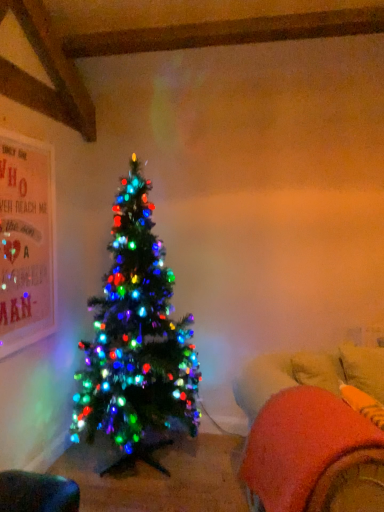
Question: Considering the relative positions of velvet orange bean bag chair at lower left, the second bean bag chair positioned from the right, and fluffy orange bean bag at lower right, acting as the second bean bag chair starting from the bottom, in the image provided, is velvet orange bean bag chair at lower left, the second bean bag chair positioned from the right, to the left of fluffy orange bean bag at lower right, acting as the second bean bag chair starting from the bottom, from the viewer's perspective?

Choices:
 (A) yes
 (B) no

Answer: (A)

Question: Is velvet orange bean bag chair at lower left, the 2th bean bag chair in the top-to-bottom sequence, oriented towards fluffy orange bean bag at lower right, placed as the 1th bean bag chair when sorted from right to left?

Choices:
 (A) yes
 (B) no

Answer: (A)

Question: Is velvet orange bean bag chair at lower left, the first bean bag chair positioned from the left, oriented away from fluffy orange bean bag at lower right, arranged as the 1th bean bag chair when viewed from the top?

Choices:
 (A) yes
 (B) no

Answer: (B)

Question: Is velvet orange bean bag chair at lower left, the first bean bag chair positioned from the left, shorter than fluffy orange bean bag at lower right, placed as the 1th bean bag chair when sorted from right to left?

Choices:
 (A) yes
 (B) no

Answer: (A)

Question: Is velvet orange bean bag chair at lower left, marked as the first bean bag chair in a bottom-to-top arrangement, with fluffy orange bean bag at lower right, acting as the 2th bean bag chair starting from the left?

Choices:
 (A) yes
 (B) no

Answer: (B)

Question: Is velvet orange bean bag chair at lower left, the 2th bean bag chair in the top-to-bottom sequence, at the right side of fluffy orange bean bag at lower right, acting as the second bean bag chair starting from the bottom?

Choices:
 (A) yes
 (B) no

Answer: (B)

Question: Is there a large distance between fluffy orange bean bag at lower right, acting as the 2th bean bag chair starting from the left, and velvet orange bean bag chair at lower left, marked as the first bean bag chair in a bottom-to-top arrangement?

Choices:
 (A) no
 (B) yes

Answer: (A)

Question: Considering the relative sizes of fluffy orange bean bag at lower right, acting as the 2th bean bag chair starting from the left, and velvet orange bean bag chair at lower left, the 2th bean bag chair in the top-to-bottom sequence, in the image provided, is fluffy orange bean bag at lower right, acting as the 2th bean bag chair starting from the left, bigger than velvet orange bean bag chair at lower left, the 2th bean bag chair in the top-to-bottom sequence,?

Choices:
 (A) no
 (B) yes

Answer: (B)

Question: Is fluffy orange bean bag at lower right, placed as the 1th bean bag chair when sorted from right to left, further to the viewer compared to velvet orange bean bag chair at lower left, the first bean bag chair positioned from the left?

Choices:
 (A) yes
 (B) no

Answer: (B)

Question: Is fluffy orange bean bag at lower right, acting as the 2th bean bag chair starting from the left, looking in the opposite direction of velvet orange bean bag chair at lower left, marked as the first bean bag chair in a bottom-to-top arrangement?

Choices:
 (A) yes
 (B) no

Answer: (B)

Question: Considering the relative positions of fluffy orange bean bag at lower right, acting as the 2th bean bag chair starting from the left, and velvet orange bean bag chair at lower left, marked as the first bean bag chair in a bottom-to-top arrangement, in the image provided, is fluffy orange bean bag at lower right, acting as the 2th bean bag chair starting from the left, to the right of velvet orange bean bag chair at lower left, marked as the first bean bag chair in a bottom-to-top arrangement, from the viewer's perspective?

Choices:
 (A) no
 (B) yes

Answer: (B)

Question: From a real-world perspective, is fluffy orange bean bag at lower right, acting as the second bean bag chair starting from the bottom, on top of velvet orange bean bag chair at lower left, marked as the first bean bag chair in a bottom-to-top arrangement?

Choices:
 (A) no
 (B) yes

Answer: (B)

Question: Based on their sizes in the image, would you say fluffy orange bean bag at lower right, placed as the 1th bean bag chair when sorted from right to left, is bigger or smaller than velvet orange bean bag chair at lower left, marked as the first bean bag chair in a bottom-to-top arrangement?

Choices:
 (A) big
 (B) small

Answer: (A)